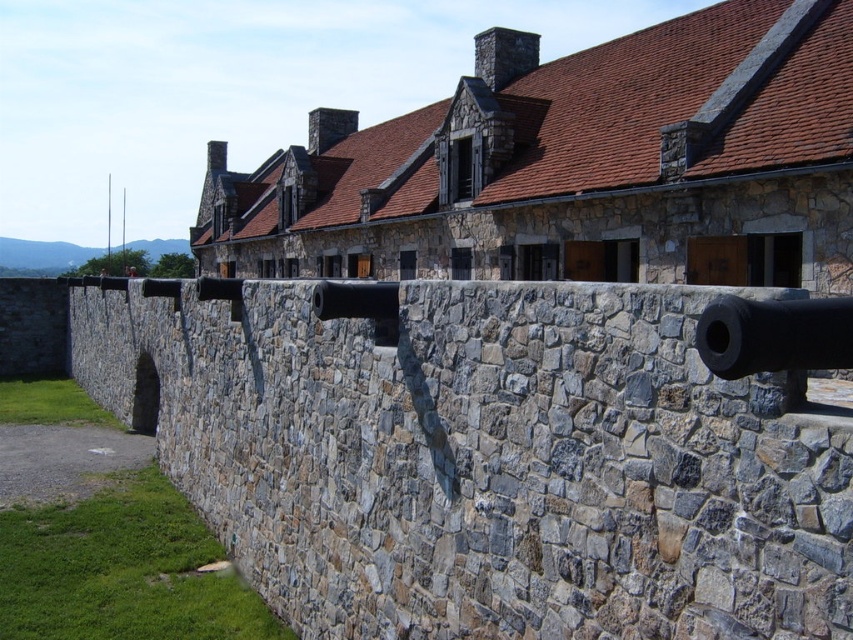
Is the position of gray stone wall at center more distant than that of stone brick building at center?

No, it is in front of stone brick building at center.

From the picture: Measure the distance between gray stone wall at center and stone brick building at center.

A distance of 51.15 feet exists between gray stone wall at center and stone brick building at center.

Between point (712, 506) and point (357, 179), which one is positioned in front?

Point (712, 506) is more forward.

Where is `gray stone wall at center`? The width and height of the screenshot is (853, 640). gray stone wall at center is located at coordinates (494, 451).

Which of these two, stone brick building at center or black matte cannon at right, stands taller?

stone brick building at center

Who is positioned more to the left, stone brick building at center or black matte cannon at right?

From the viewer's perspective, stone brick building at center appears more on the left side.

What do you see at coordinates (575, 164) in the screenshot? I see `stone brick building at center` at bounding box center [575, 164].

Locate an element on the screen. This screenshot has height=640, width=853. stone brick building at center is located at coordinates (575, 164).

Does gray stone wall at center appear on the left side of black matte cannon at right?

Indeed, gray stone wall at center is positioned on the left side of black matte cannon at right.

Is gray stone wall at center thinner than black matte cannon at right?

No.

Locate an element on the screen. The image size is (853, 640). gray stone wall at center is located at coordinates [494, 451].

The height and width of the screenshot is (640, 853). What are the coordinates of `gray stone wall at center` in the screenshot? It's located at (494, 451).